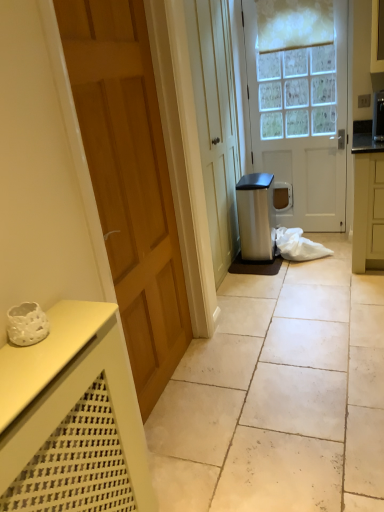
What do you see at coordinates (255, 217) in the screenshot?
I see `satin silver trash can at center-right` at bounding box center [255, 217].

Find the location of `white glossy door at center, which appears as the 2th door when viewed from the left`. white glossy door at center, which appears as the 2th door when viewed from the left is located at coordinates (301, 121).

Based on the photo, measure the distance from white glossy door at center, positioned as the 1th door in back-to-front order, to white fabric at center.

white glossy door at center, positioned as the 1th door in back-to-front order, and white fabric at center are 33.90 inches apart.

Can we say white glossy door at center, positioned as the 1th door in back-to-front order, lies outside white fabric at center?

Indeed, white glossy door at center, positioned as the 1th door in back-to-front order, is completely outside white fabric at center.

Considering the relative sizes of white glossy door at center, positioned as the 1th door in back-to-front order, and white fabric at center in the image provided, is white glossy door at center, positioned as the 1th door in back-to-front order, shorter than white fabric at center?

In fact, white glossy door at center, positioned as the 1th door in back-to-front order, may be taller than white fabric at center.

From a real-world perspective, between white glossy door at center, positioned as the 1th door in back-to-front order, and white fabric at center, who is vertically lower?

white fabric at center is physically lower.

Considering the relative sizes of satin silver trash can at center-right and white fabric at center in the image provided, is satin silver trash can at center-right smaller than white fabric at center?

No.

From a real-world perspective, is satin silver trash can at center-right physically located above or below white fabric at center?

In terms of real-world spatial position, satin silver trash can at center-right is above white fabric at center.

Relative to white fabric at center, is satin silver trash can at center-right in front or behind?

satin silver trash can at center-right is positioned closer to the viewer than white fabric at center.

Considering the relative sizes of satin silver trash can at center-right and white fabric at center in the image provided, is satin silver trash can at center-right shorter than white fabric at center?

In fact, satin silver trash can at center-right may be taller than white fabric at center.

In the scene shown: Which point is more forward, (118,134) or (306,342)?

The point (118,134) is closer to the camera.

From a real-world perspective, is wooden door at left, the 2th door in the right-to-left sequence, below white tile floor at center?

Actually, wooden door at left, the 2th door in the right-to-left sequence, is physically above white tile floor at center in the real world.

In the image, is wooden door at left, the 2th door in the right-to-left sequence, positioned in front of or behind white tile floor at center?

Clearly, wooden door at left, the 2th door in the right-to-left sequence, is in front of white tile floor at center.

Is white tile floor at center aimed at white fabric at center?

No, white tile floor at center does not turn towards white fabric at center.

Considering the relative sizes of white tile floor at center and white fabric at center in the image provided, is white tile floor at center smaller than white fabric at center?

Incorrect, white tile floor at center is not smaller in size than white fabric at center.

You are a GUI agent. You are given a task and a screenshot of the screen. Output one action in this format:
    pyautogui.click(x=<x>, y=<y>)
    Task: Click on the concrete that appears below the white fabric at center (from the image's perspective)
    This screenshot has width=384, height=512.
    Given the screenshot: What is the action you would take?
    pyautogui.click(x=279, y=396)

Can you confirm if white fabric at center is thinner than white tile floor at center?

Correct, the width of white fabric at center is less than that of white tile floor at center.

Considering the relative positions of white fabric at center and white tile floor at center in the image provided, is white fabric at center to the left of white tile floor at center from the viewer's perspective?

Incorrect, white fabric at center is not on the left side of white tile floor at center.

Locate an element on the screen. This screenshot has height=512, width=384. concrete located in front of the white fabric at center is located at coordinates pos(279,396).

Is white fabric at center positioned far away from white tile floor at center?

white fabric at center is positioned a significant distance from white tile floor at center.

Which is in front, white fabric at center or wooden door at left, the 2th door in the right-to-left sequence?

Positioned in front is wooden door at left, the 2th door in the right-to-left sequence.

You are a GUI agent. You are given a task and a screenshot of the screen. Output one action in this format:
    pyautogui.click(x=<x>, y=<y>)
    Task: Click on the 2nd door to the left of the white fabric at center, counting from the anchor's position
    
    Given the screenshot: What is the action you would take?
    pyautogui.click(x=129, y=181)

From a real-world perspective, relative to wooden door at left, which ranks as the 1th door in left-to-right order, is white fabric at center vertically above or below?

white fabric at center is below wooden door at left, which ranks as the 1th door in left-to-right order.

Is wooden door at left, which ranks as the 1th door in left-to-right order, completely or partially inside white fabric at center?

No, white fabric at center does not contain wooden door at left, which ranks as the 1th door in left-to-right order.

Is white fabric at center aimed at satin silver trash can at center-right?

No.

Which is more to the right, white fabric at center or satin silver trash can at center-right?

white fabric at center.

Who is smaller, white fabric at center or satin silver trash can at center-right?

With smaller size is white fabric at center.

From a real-world perspective, is white fabric at center under satin silver trash can at center-right?

Indeed, from a real-world perspective, white fabric at center is positioned beneath satin silver trash can at center-right.

From the image's perspective, which door is the 2nd one above the white fabric at center? Please provide its 2D coordinates.

[(301, 121)]

Where is `material behind the satin silver trash can at center-right`? The height and width of the screenshot is (512, 384). material behind the satin silver trash can at center-right is located at coordinates (298, 245).

From the image, which object appears to be farther from satin silver trash can at center-right, wooden door at left, which ranks as the 1th door in left-to-right order, or white glossy door at center, positioned as the 1th door in back-to-front order?

Based on the image, wooden door at left, which ranks as the 1th door in left-to-right order, appears to be further to satin silver trash can at center-right.

Based on their spatial positions, is wooden door at left, the 2th door in the right-to-left sequence, or white fabric at center closer to white tile floor at center?

wooden door at left, the 2th door in the right-to-left sequence, is closer to white tile floor at center.

Looking at the image, which one is located closer to white fabric at center, white tile floor at center or satin silver trash can at center-right?

satin silver trash can at center-right.

Looking at this image, based on their spatial positions, is wooden door at left, the 2th door in the right-to-left sequence, or satin silver trash can at center-right further from white tile floor at center?

The object further to white tile floor at center is satin silver trash can at center-right.

Based on their spatial positions, is wooden door at left, the 2th door in the right-to-left sequence, or satin silver trash can at center-right closer to white glossy door at center, positioned as the 1th door in back-to-front order?

Among the two, satin silver trash can at center-right is located nearer to white glossy door at center, positioned as the 1th door in back-to-front order.

Based on the photo, which object lies further to the anchor point wooden door at left, the 2th door in the right-to-left sequence, white tile floor at center or white fabric at center?

Based on the image, white fabric at center appears to be further to wooden door at left, the 2th door in the right-to-left sequence.

From the image, which object appears to be farther from white glossy door at center, which appears as the 2th door when viewed from the left, white fabric at center or satin silver trash can at center-right?

Based on the image, white fabric at center appears to be further to white glossy door at center, which appears as the 2th door when viewed from the left.

Based on their spatial positions, is white tile floor at center or wooden door at left, which ranks as the 1th door in left-to-right order, further from satin silver trash can at center-right?

wooden door at left, which ranks as the 1th door in left-to-right order, is positioned further to the anchor satin silver trash can at center-right.

Identify the location of concrete positioned between wooden door at left, which ranks as the 1th door in left-to-right order, and satin silver trash can at center-right from near to far. Image resolution: width=384 pixels, height=512 pixels. [279, 396].

Find the location of a particular element. The width and height of the screenshot is (384, 512). appliance located between white tile floor at center and white fabric at center in the depth direction is located at coordinates point(255,217).

Locate an element on the screen. appliance between wooden door at left, which is the second door in back-to-front order, and white fabric at center, along the z-axis is located at coordinates (255, 217).

Where is `concrete located between wooden door at left, which is the second door in back-to-front order, and white glossy door at center, which appears as the 2th door when viewed from the left, in the depth direction`? This screenshot has width=384, height=512. concrete located between wooden door at left, which is the second door in back-to-front order, and white glossy door at center, which appears as the 2th door when viewed from the left, in the depth direction is located at coordinates (279, 396).